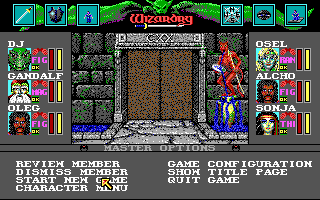
The height and width of the screenshot is (200, 320). I want to click on vertical doorway columns, so click(x=117, y=82), click(x=202, y=83).